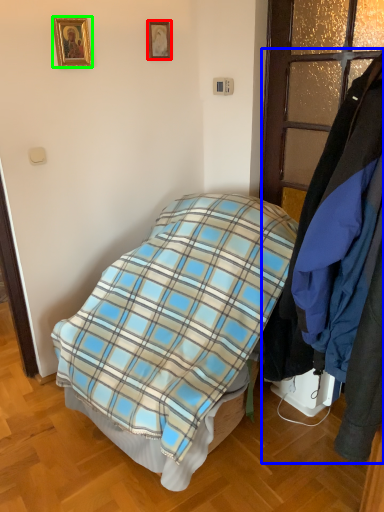
Question: Which object is positioned closest to picture frame (highlighted by a red box)? Select from closet (highlighted by a blue box) and picture frame (highlighted by a green box).

Choices:
 (A) closet
 (B) picture frame

Answer: (B)